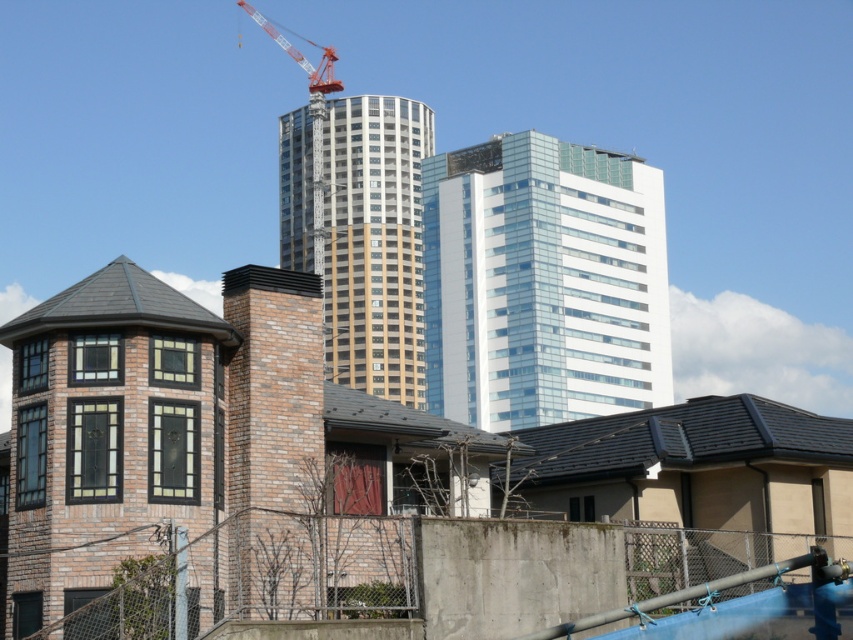
You are an architect observing the scene. You need to determine the spatial relationship between the beige glass tower at center and the red metallic crane at upper center. Which object is located to the right of the other?

The beige glass tower at center is positioned on the right side of the red metallic crane at upper center.

You are standing at a viewpoint where you can see both the traditional brick house and the modern high rise under construction. A point marked at coordinates point (401, 346) is visible in your line of sight. If you want to estimate how far this point is from you, what would be the distance?

The distance of point (401, 346) from viewer is 649.64 feet.